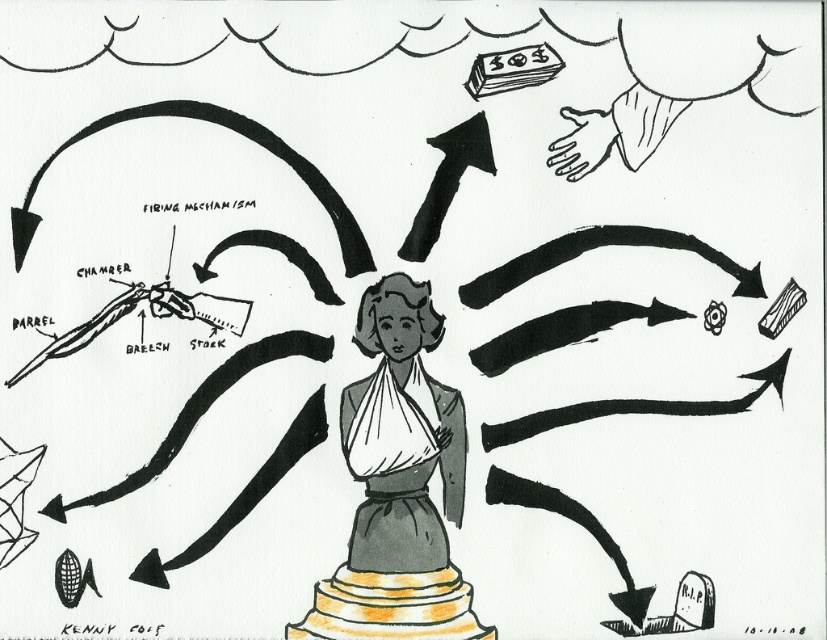
Is gray fabric dress at center to the left of dark gray fabric dress at center from the viewer's perspective?

Indeed, gray fabric dress at center is positioned on the left side of dark gray fabric dress at center.

Image resolution: width=827 pixels, height=640 pixels. What do you see at coordinates (398, 486) in the screenshot? I see `gray fabric dress at center` at bounding box center [398, 486].

You are a GUI agent. You are given a task and a screenshot of the screen. Output one action in this format:
    pyautogui.click(x=<x>, y=<y>)
    Task: Click on the gray fabric dress at center
    Image resolution: width=827 pixels, height=640 pixels.
    Given the screenshot: What is the action you would take?
    pyautogui.click(x=398, y=486)